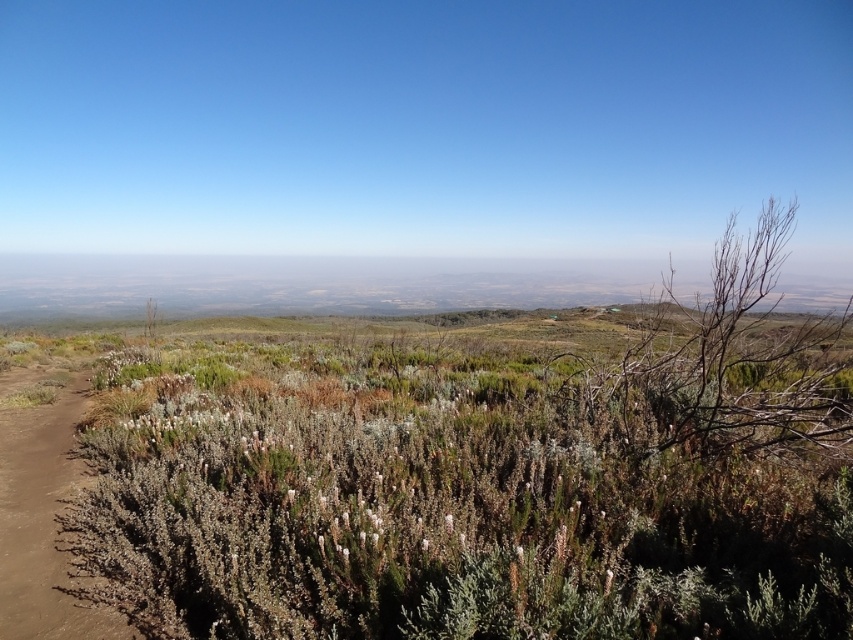
Question: Which point is farther from the camera taking this photo?

Choices:
 (A) (161, 401)
 (B) (54, 634)

Answer: (A)

Question: Is green shrubbery at center to the left of brown dirt path at lower left from the viewer's perspective?

Choices:
 (A) yes
 (B) no

Answer: (B)

Question: Can you confirm if green shrubbery at center is positioned to the right of brown dirt path at lower left?

Choices:
 (A) no
 (B) yes

Answer: (B)

Question: Which of the following is the farthest from the observer?

Choices:
 (A) (308, 628)
 (B) (51, 515)

Answer: (B)

Question: Is the position of green shrubbery at center more distant than that of brown dirt path at lower left?

Choices:
 (A) yes
 (B) no

Answer: (B)